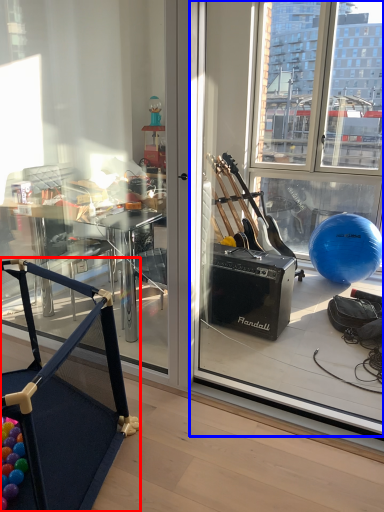
Question: Which object appears closest to the camera in this image, furniture (highlighted by a red box) or window screen (highlighted by a blue box)?

Choices:
 (A) furniture
 (B) window screen

Answer: (A)